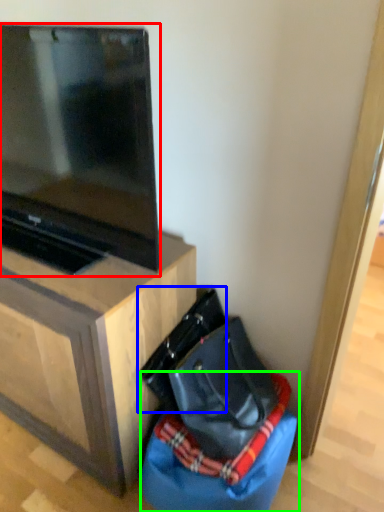
Question: Estimate the real-world distances between objects in this image. Which object is farther from television (highlighted by a red box), messenger bag (highlighted by a blue box) or bean bag chair (highlighted by a green box)?

Choices:
 (A) messenger bag
 (B) bean bag chair

Answer: (B)